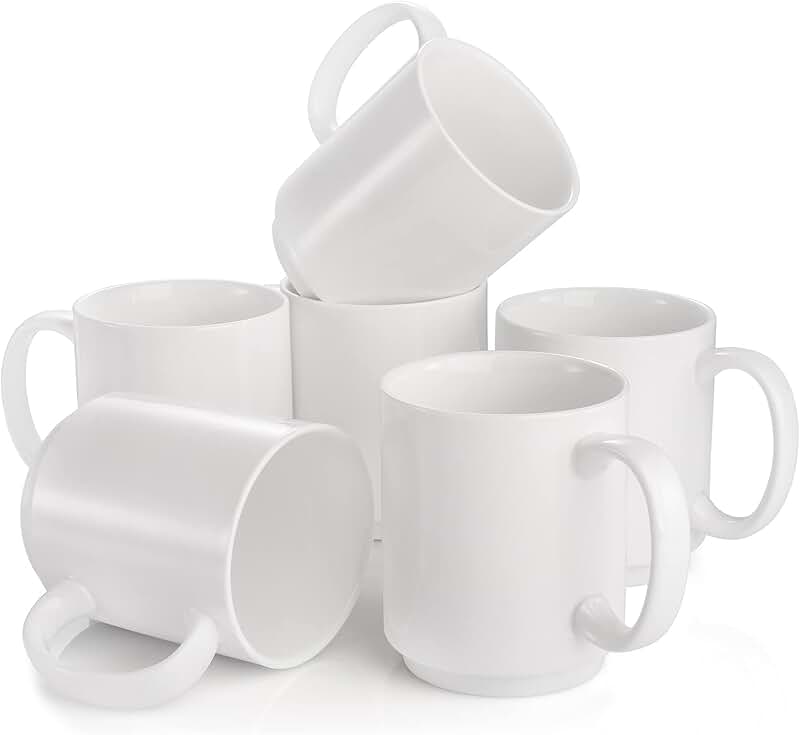
You are a GUI agent. You are given a task and a screenshot of the screen. Output one action in this format:
    pyautogui.click(x=<x>, y=<y>)
    Task: Click on the white mug
    The image size is (800, 735).
    Given the screenshot: What is the action you would take?
    pyautogui.click(x=242, y=376), pyautogui.click(x=357, y=359), pyautogui.click(x=425, y=237), pyautogui.click(x=654, y=380), pyautogui.click(x=510, y=492), pyautogui.click(x=162, y=495)